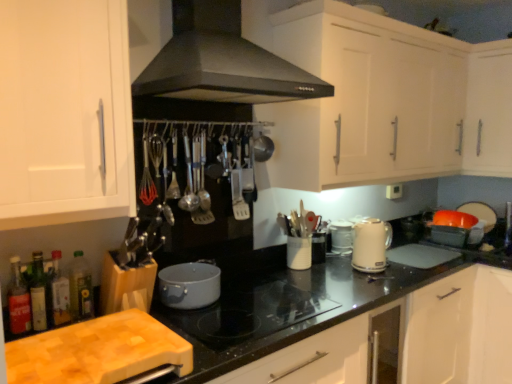
Locate an element on the screen. This screenshot has width=512, height=384. empty space that is ontop of matte gray pot at center, marked as the fifth appliance in a back-to-front arrangement (from a real-world perspective) is located at coordinates pyautogui.click(x=181, y=266).